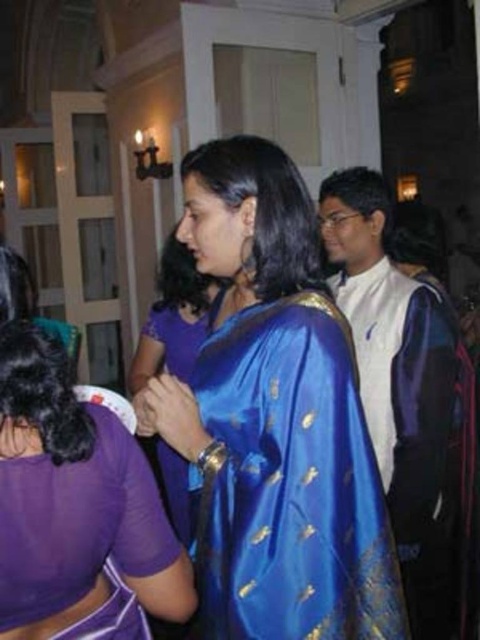
You are standing in the center of the room and want to hand a gift to the woman in the vibrant blue saree. To do so, you need to move towards her location marked by the point at the lower left. However, there is an obstacle at point (74, 502). What object is blocking your path at that point?

The purple satin blouse at lower left is blocking your path at point (74, 502).

You are a photographer at the event and need to capture a clear shot of both the blue silk saree at center and the satin blue saree at center. Since they are both at the center, how can you ensure both are visible in the photo?

The blue silk saree at center is positioned under the satin blue saree at center, so adjusting the camera angle slightly upward might help capture both layers without one blocking the other.

You are a photographer at the event and want to ensure both the blue silk sari at center and the satin blue saree at center are fully visible in your shot. Which one requires a wider angle to capture its full detail?

The satin blue saree at center requires a wider angle because it is larger in size compared to the blue silk sari at center.